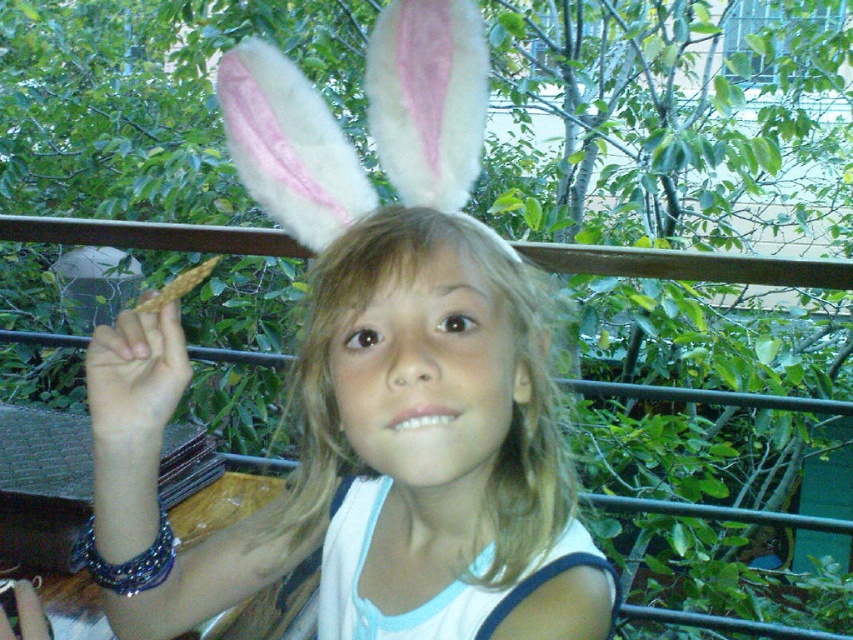
Question: Which point is closer to the camera?

Choices:
 (A) (213, 564)
 (B) (358, 221)

Answer: (B)

Question: Does white fluffy bunny ears at upper center appear on the left side of matte white head at center?

Choices:
 (A) no
 (B) yes

Answer: (B)

Question: Is white fluffy bunny ears at upper center smaller than matte white head at center?

Choices:
 (A) no
 (B) yes

Answer: (A)

Question: Considering the relative positions of white fluffy bunny ears at upper center and matte white head at center in the image provided, where is white fluffy bunny ears at upper center located with respect to matte white head at center?

Choices:
 (A) left
 (B) right

Answer: (A)